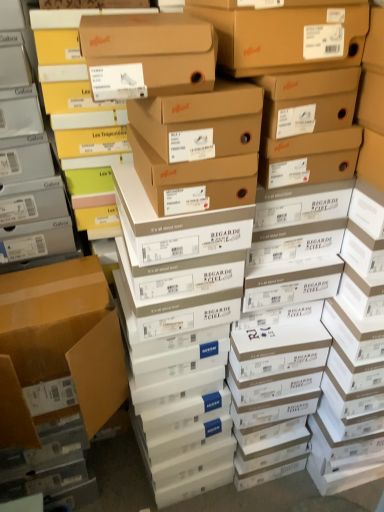
Question: Does matte gray shoebox at left have a greater height compared to matte cardboard box at left?

Choices:
 (A) yes
 (B) no

Answer: (A)

Question: Can you confirm if matte gray shoebox at left is positioned to the left of matte cardboard box at left?

Choices:
 (A) yes
 (B) no

Answer: (A)

Question: Would you consider matte gray shoebox at left to be distant from matte cardboard box at left?

Choices:
 (A) no
 (B) yes

Answer: (A)

Question: Is matte gray shoebox at left at the right side of matte cardboard box at left?

Choices:
 (A) yes
 (B) no

Answer: (B)

Question: Could you tell me if matte gray shoebox at left is turned towards matte cardboard box at left?

Choices:
 (A) no
 (B) yes

Answer: (A)

Question: Is matte gray shoebox at left further to the viewer compared to matte cardboard box at left?

Choices:
 (A) yes
 (B) no

Answer: (B)

Question: Is matte cardboard box at left beside matte gray shoebox at left?

Choices:
 (A) no
 (B) yes

Answer: (A)

Question: Is matte cardboard box at left thinner than matte gray shoebox at left?

Choices:
 (A) yes
 (B) no

Answer: (B)

Question: Does matte cardboard box at left appear on the left side of matte gray shoebox at left?

Choices:
 (A) yes
 (B) no

Answer: (B)

Question: Is matte cardboard box at left wider than matte gray shoebox at left?

Choices:
 (A) yes
 (B) no

Answer: (A)

Question: Is matte gray shoebox at left completely or partially inside matte cardboard box at left?

Choices:
 (A) no
 (B) yes

Answer: (A)

Question: Is the position of matte cardboard box at left less distant than that of matte gray shoebox at left?

Choices:
 (A) no
 (B) yes

Answer: (A)

Question: From the image's perspective, is matte gray shoebox at left located above or below matte cardboard box at left?

Choices:
 (A) below
 (B) above

Answer: (B)